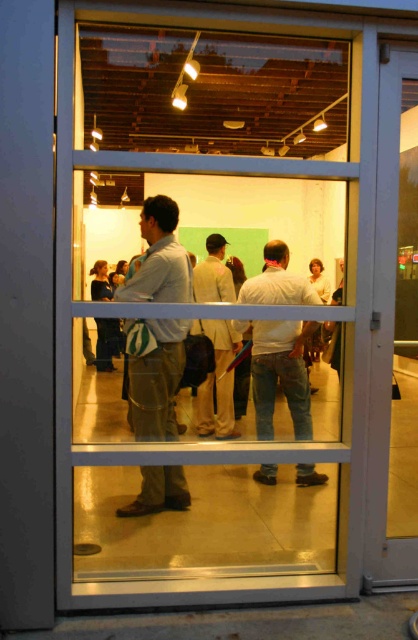
You are holding a 3.5 feet wide painting and want to carry it through the white glossy door at right while standing near the light brown fabric shirt at center. Can you fit the painting through the door without tilting it?

The distance between the white glossy door at right and the light brown fabric shirt at center is 4.39 feet. Since the painting is 3.5 feet wide, it can fit through the door as the available space is wider than the painting.

You are standing outside the glass door and want to see both the light brown fabric shirt at center and the light beige suit at center inside the gallery. Which one do you see closer to you in the reflection?

In the reflection, the light brown fabric shirt at center appears closer to you because it is physically nearer to the glass door than the light beige suit at center.

You are standing outside the gallery and want to enter through the clear glass door at center. However, there is a person wearing a light beige suit at center blocking your path. Can you walk around them to reach the door?

The clear glass door at center is larger in size than light beige suit at center, so yes, you can walk around the person wearing the light beige suit at center to reach the door since the door is bigger and there is enough space around the person.